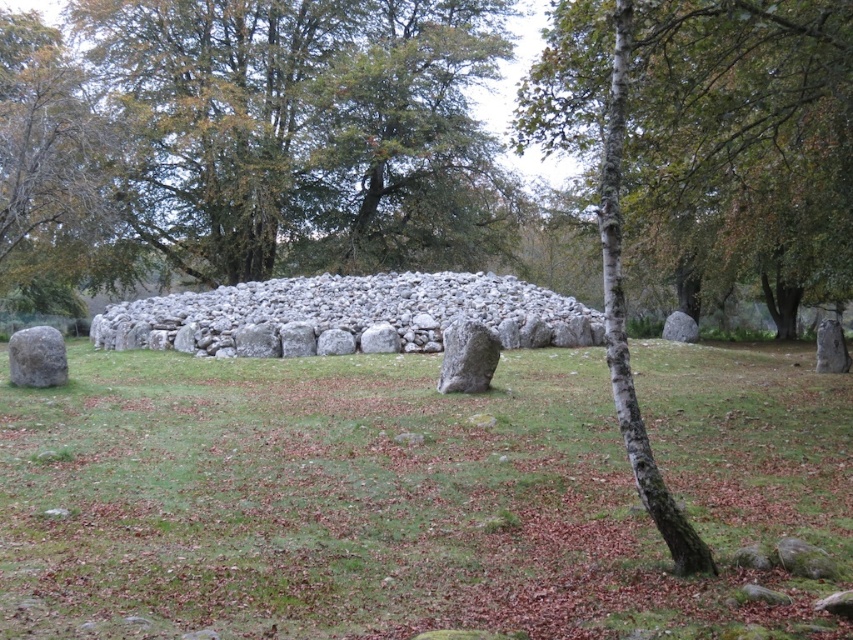
Between bark textured tree at center and gray rough boulder at center, which one has less height?

Standing shorter between the two is gray rough boulder at center.

Who is more distant from viewer, (x=663, y=68) or (x=488, y=349)?

Point (x=488, y=349)

The image size is (853, 640). In order to click on bark textured tree at center in this screenshot , I will do `click(705, 154)`.

Is point (509, 472) positioned before point (466, 349)?

Yes, point (509, 472) is closer to viewer.

Is point (416, 465) farther from viewer compared to point (492, 333)?

No, it is not.

What do you see at coordinates (410, 496) in the screenshot? The height and width of the screenshot is (640, 853). I see `green grass at center` at bounding box center [410, 496].

Where is `green grass at center`? The height and width of the screenshot is (640, 853). green grass at center is located at coordinates (410, 496).

Is point (460, 416) more distant than point (675, 525)?

Yes.

In order to click on green grass at center in this screenshot , I will do `click(410, 496)`.